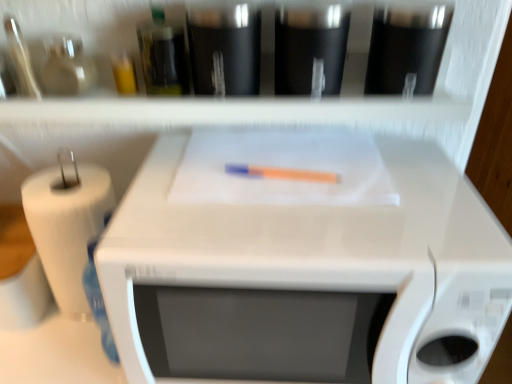
Question: Is white glossy microwave at center surrounding white paper at left?

Choices:
 (A) no
 (B) yes

Answer: (A)

Question: From a real-world perspective, is white glossy microwave at center over white paper at left?

Choices:
 (A) yes
 (B) no

Answer: (A)

Question: Can you confirm if white glossy microwave at center is smaller than white paper at left?

Choices:
 (A) yes
 (B) no

Answer: (B)

Question: Does white glossy microwave at center have a larger size compared to white paper at left?

Choices:
 (A) yes
 (B) no

Answer: (A)

Question: Considering the relative sizes of white glossy microwave at center and white paper at left in the image provided, is white glossy microwave at center shorter than white paper at left?

Choices:
 (A) yes
 (B) no

Answer: (B)

Question: Is white glossy microwave at center completely or partially outside of white paper at left?

Choices:
 (A) yes
 (B) no

Answer: (A)

Question: From a real-world perspective, is orange matte crayon at center located higher than white paper at left?

Choices:
 (A) no
 (B) yes

Answer: (B)

Question: Is orange matte crayon at center further to the viewer compared to white paper at left?

Choices:
 (A) no
 (B) yes

Answer: (A)

Question: Can you confirm if orange matte crayon at center is thinner than white paper at left?

Choices:
 (A) yes
 (B) no

Answer: (A)

Question: Could you tell me if orange matte crayon at center is facing white paper at left?

Choices:
 (A) no
 (B) yes

Answer: (A)

Question: From the image's perspective, is orange matte crayon at center located beneath white paper at left?

Choices:
 (A) yes
 (B) no

Answer: (B)

Question: Is white paper at left surrounded by orange matte crayon at center?

Choices:
 (A) no
 (B) yes

Answer: (A)

Question: Does white glossy microwave at center come behind white matte shelf at upper center?

Choices:
 (A) yes
 (B) no

Answer: (B)